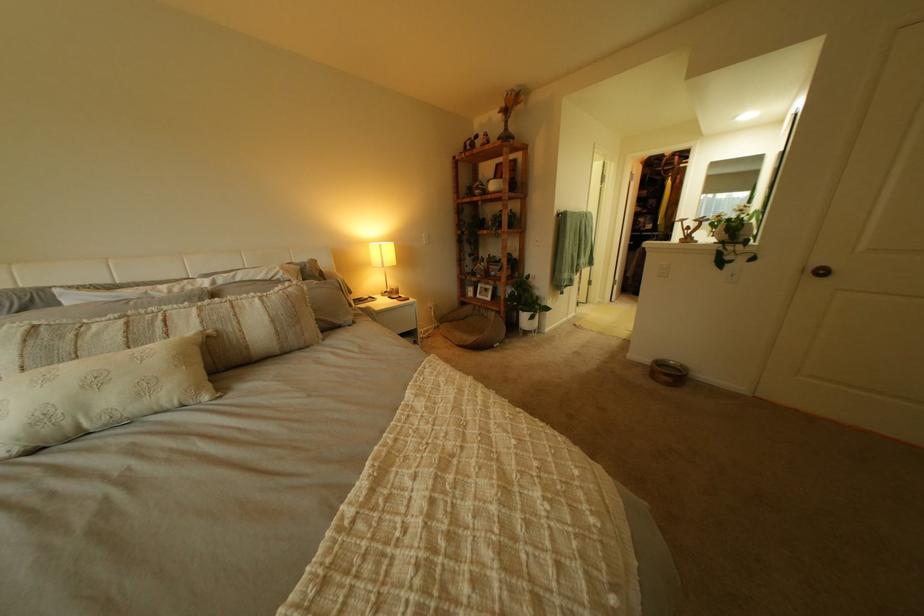
Describe the element at coordinates (821, 270) in the screenshot. I see `a round door knob` at that location.